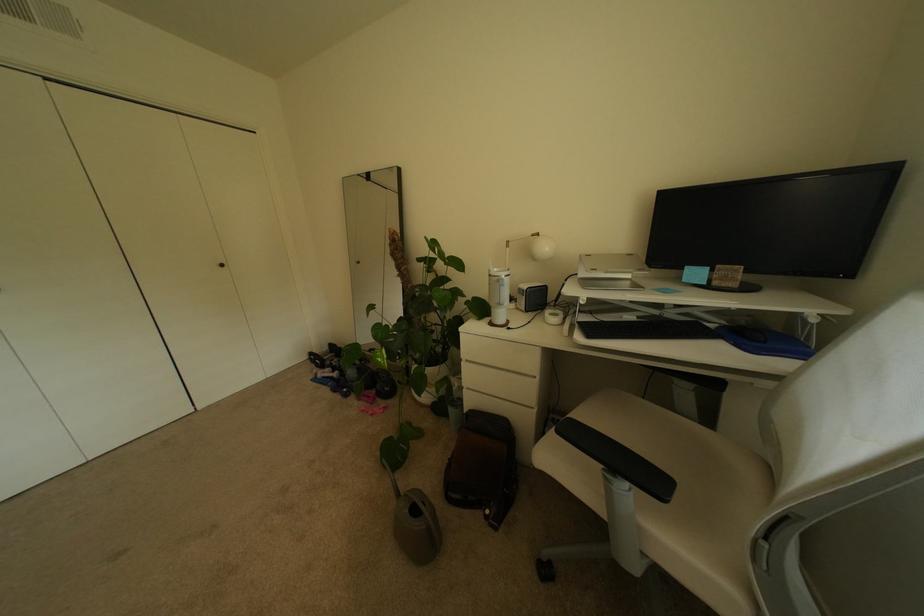
Find where to sit the chair sitting surface. Please return your answer as a coordinate pair (x, y).

(712, 483)